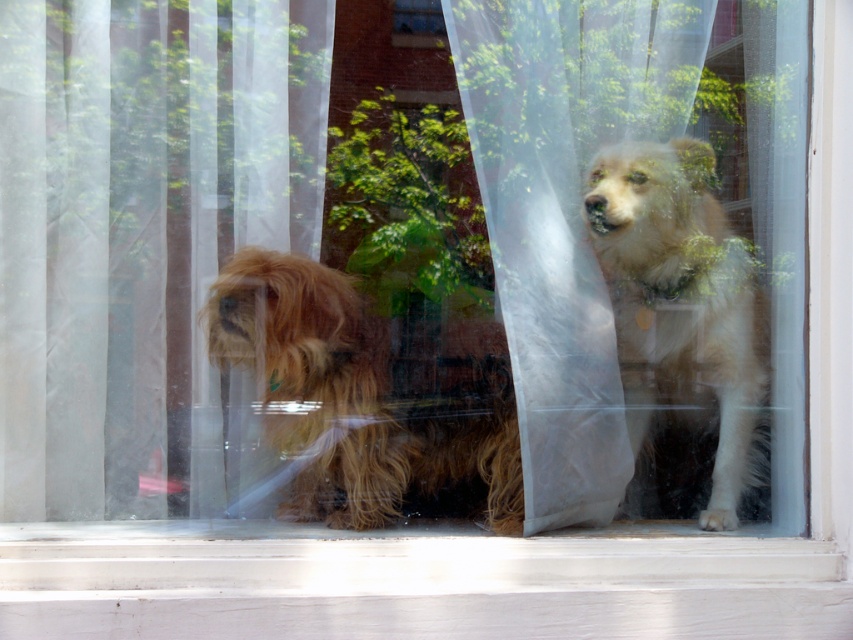
Can you confirm if fuzzy brown dog at left is positioned to the right of transparent plastic window at center?

No, fuzzy brown dog at left is not to the right of transparent plastic window at center.

Is fuzzy brown dog at left to the left of transparent plastic window at center from the viewer's perspective?

Indeed, fuzzy brown dog at left is positioned on the left side of transparent plastic window at center.

Identify the location of fuzzy brown dog at left. (360, 396).

Identify the location of fuzzy brown dog at left. This screenshot has width=853, height=640. (360, 396).

Which is more to the right, translucent white curtain at left or transparent plastic window at center?

Positioned to the right is transparent plastic window at center.

Where is `translucent white curtain at left`? This screenshot has width=853, height=640. translucent white curtain at left is located at coordinates (143, 240).

In order to click on translucent white curtain at left in this screenshot , I will do `click(143, 240)`.

Is translucent white curtain at left further to camera compared to fuzzy brown dog at left?

Yes.

Between point (82, 378) and point (378, 524), which one is positioned in front?

Positioned in front is point (378, 524).

Is point (33, 392) positioned in front of point (316, 456)?

Yes, it is.

Where is `translucent white curtain at left`? This screenshot has width=853, height=640. translucent white curtain at left is located at coordinates (143, 240).